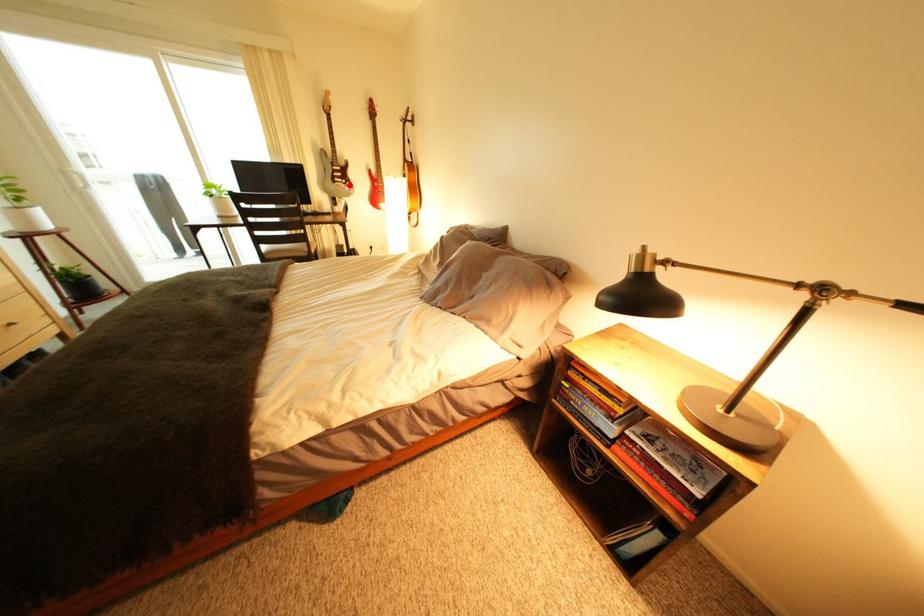
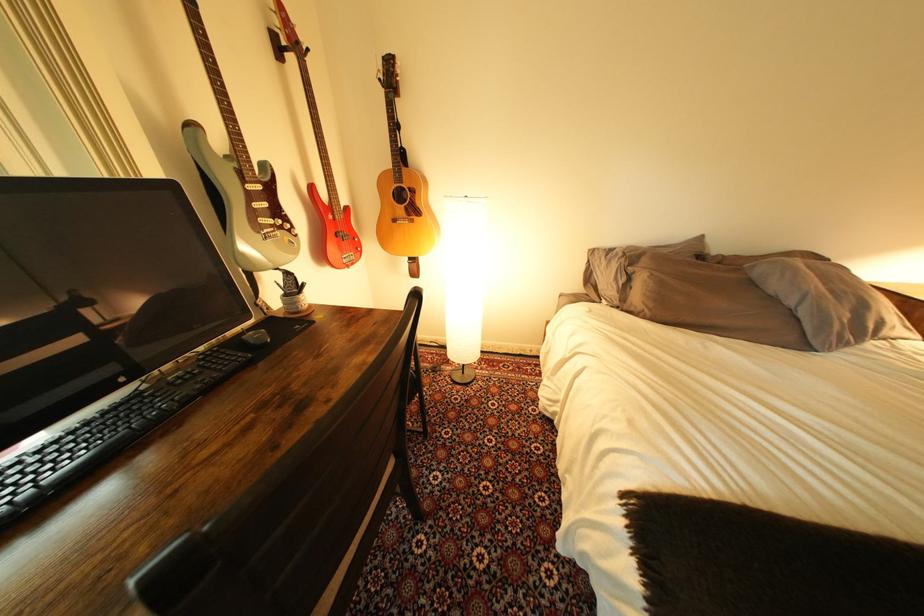
Find the pixel in the second image that matches the highlighted location in the first image.

(278, 233)